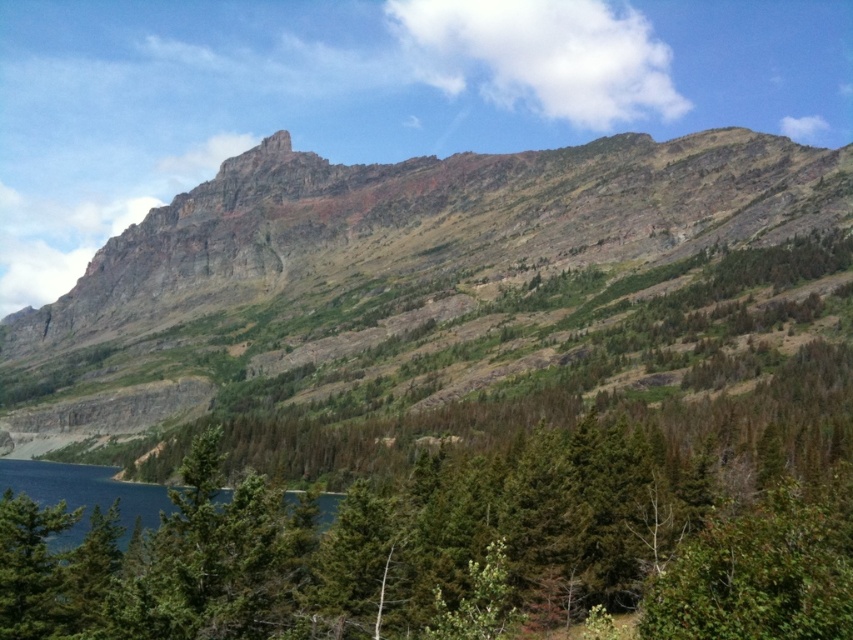
You are standing at the base of the mountain and looking towards the peak. There are two points marked on the mountain slope. The first point is located at coordinates point [775,276], and the second point is at point [149,486]. Which point is closer to you?

Point [775,276] is closer to the viewer than point [149,486].

In the scene shown: You are a hiker planning to take a photo of the rugged stone mountain at upper center and the deep blue water at lower left. Which object in the scene is wider?

The rugged stone mountain at upper center is wider than the deep blue water at lower left.

From the picture: You are standing in the forest looking towards the mountain. Which object is positioned to the right when comparing rugged stone mountain at upper center and green matte tree at lower left?

The rugged stone mountain at upper center is positioned to the right of the green matte tree at lower left.